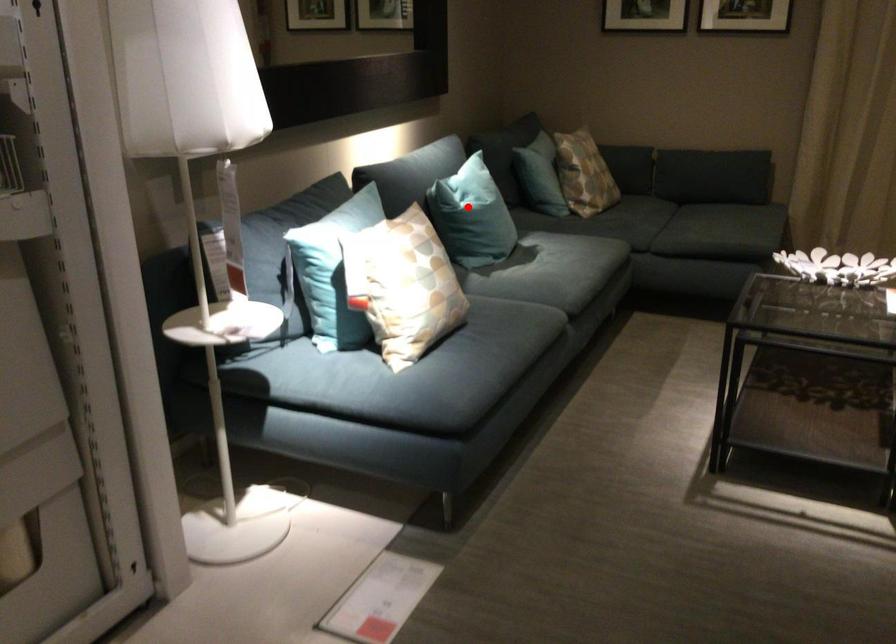
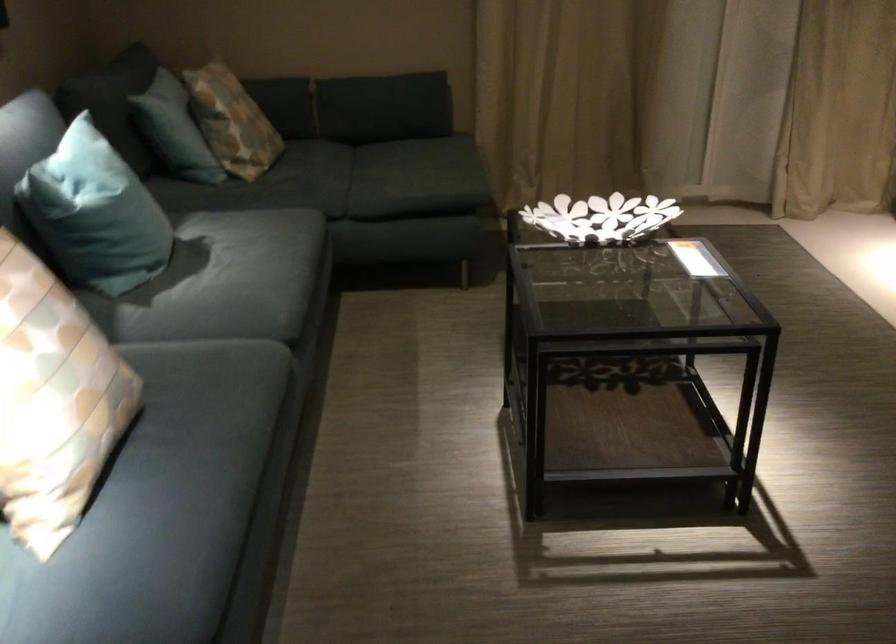
Question: I am providing you with two images of the same scene from different viewpoints. A red point is shown in image1. For the corresponding object point in image2, is it positioned nearer or farther from the camera?

Choices:
 (A) Nearer
 (B) Farther

Answer: (A)